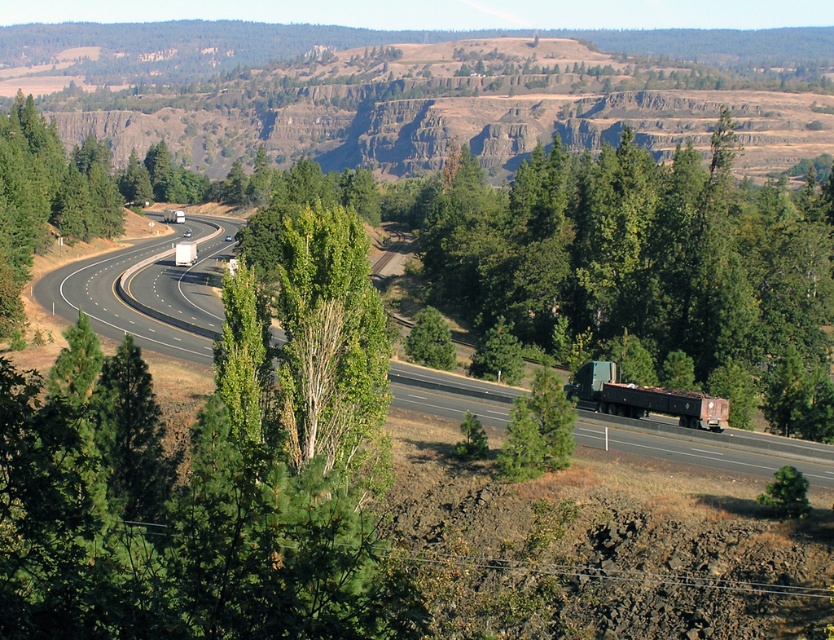
Between point (571, 396) and point (417, 314), which one is positioned behind?

The point (417, 314) is more distant.

Is rusty metal trailer truck at right further to camera compared to green leafy tree at center?

No.

This screenshot has height=640, width=834. In order to click on rusty metal trailer truck at right in this screenshot , I will do `click(642, 397)`.

You are a GUI agent. You are given a task and a screenshot of the screen. Output one action in this format:
    pyautogui.click(x=<x>, y=<y>)
    Task: Click on the rusty metal trailer truck at right
    The image size is (834, 640).
    Given the screenshot: What is the action you would take?
    pyautogui.click(x=642, y=397)

Which is below, rugged brown cliff at upper center or green leafy tree at right?

green leafy tree at right is lower down.

Is point (204, 28) positioned in front of point (821, 376)?

No, it is not.

Find the location of a particular element. This screenshot has height=640, width=834. rugged brown cliff at upper center is located at coordinates (417, 90).

Measure the distance between black asphalt highway at center and smooth asphalt highway at center-left.

They are 9.67 feet apart.

Is point (217, 312) positioned behind point (96, 282)?

That is False.

Identify the location of black asphalt highway at center. The height and width of the screenshot is (640, 834). (148, 292).